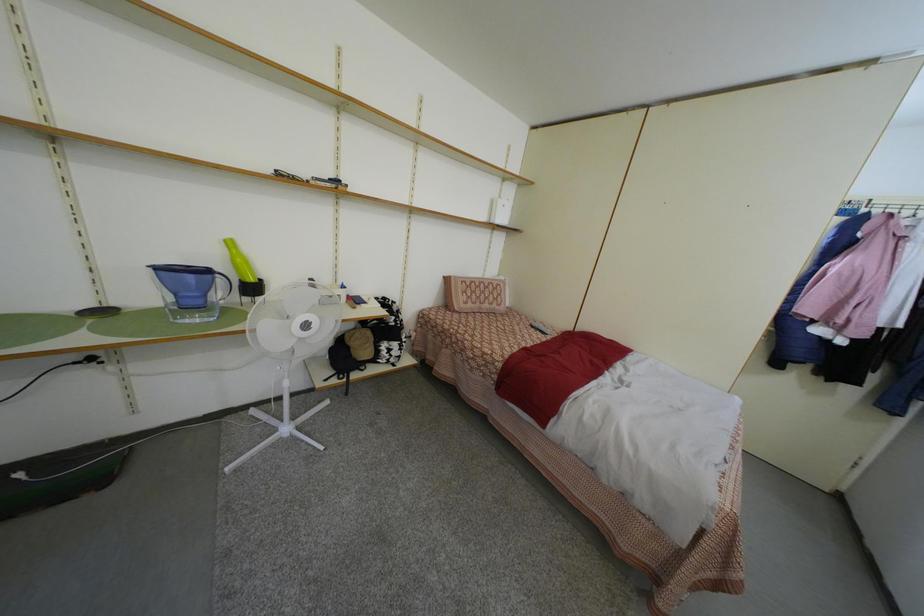
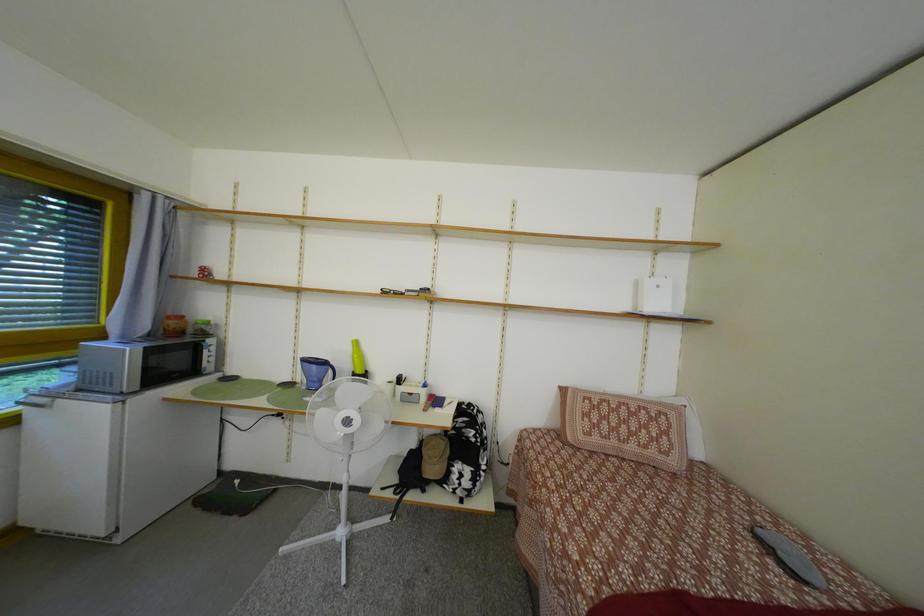
How did the camera likely rotate?

The camera's rotation is toward left-up.